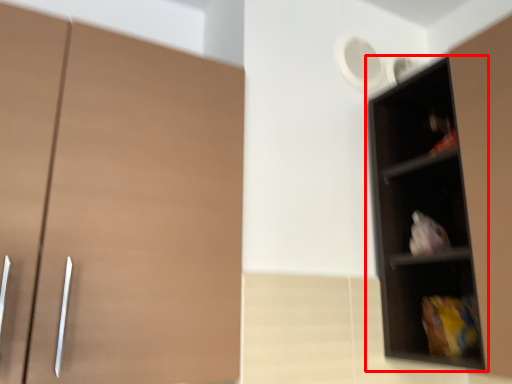
Question: From the image's perspective, considering the relative positions of shelf (annotated by the red box) and cupboard in the image provided, where is shelf (annotated by the red box) located with respect to the staircase?

Choices:
 (A) below
 (B) above

Answer: (A)